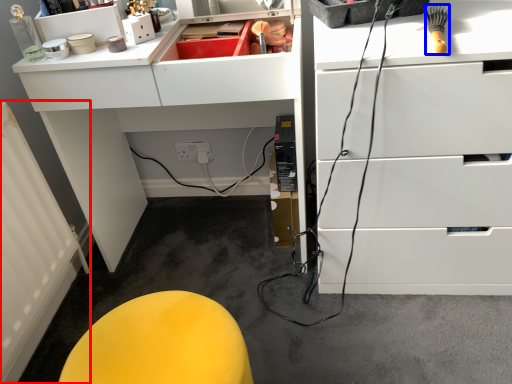
Question: Which of the following is the closest to the observer, radiator (highlighted by a red box) or brush (highlighted by a blue box)?

Choices:
 (A) radiator
 (B) brush

Answer: (B)